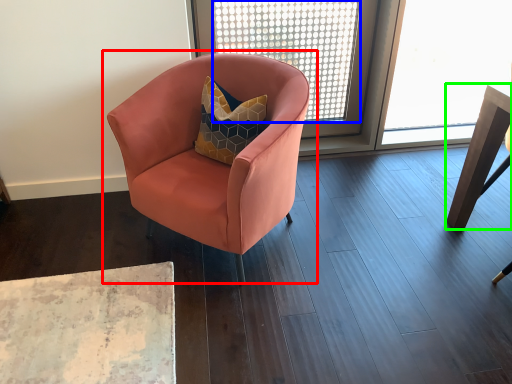
Question: Which object is positioned farthest from chair (highlighted by a red box)? Select from window screen (highlighted by a blue box) and table (highlighted by a green box).

Choices:
 (A) window screen
 (B) table

Answer: (A)